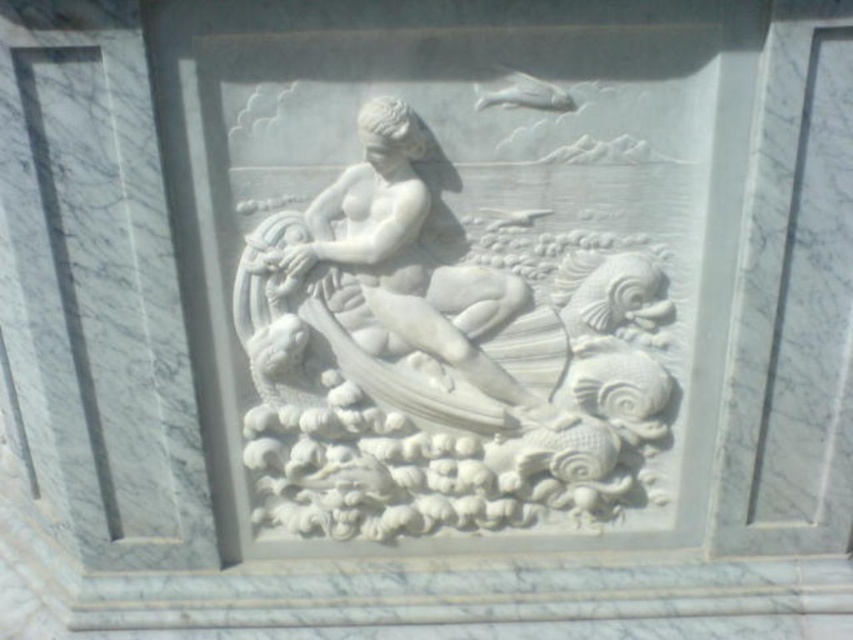
Question: Does white marble mermaid at center lie in front of white marble statue at center?

Choices:
 (A) yes
 (B) no

Answer: (B)

Question: Which object appears farthest from the camera in this image?

Choices:
 (A) white marble mermaid at center
 (B) white marble statue at center

Answer: (A)

Question: Is white marble mermaid at center to the left of white marble statue at center from the viewer's perspective?

Choices:
 (A) no
 (B) yes

Answer: (A)

Question: Is white marble mermaid at center to the left of white marble statue at center from the viewer's perspective?

Choices:
 (A) no
 (B) yes

Answer: (A)